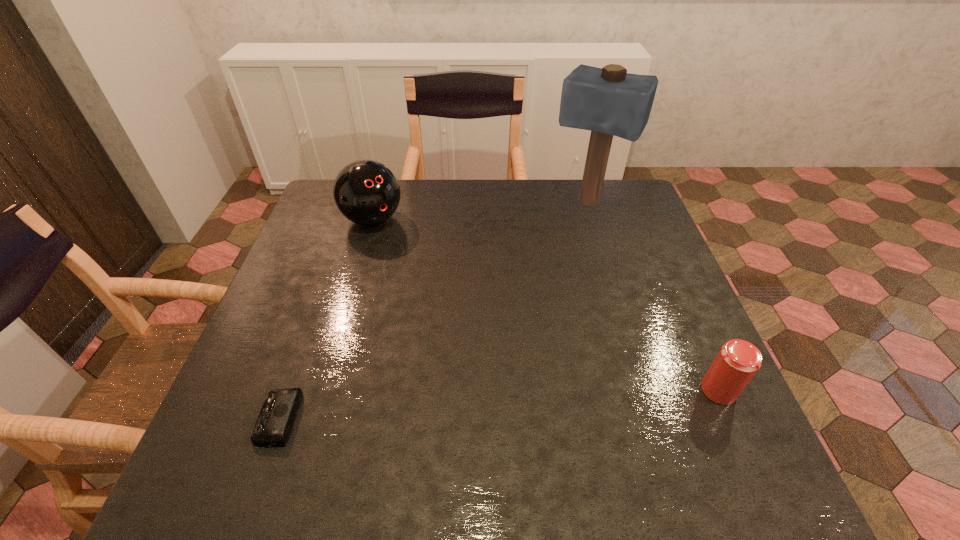
Locate an element on the screen. This screenshot has height=540, width=960. vacant space situated on the striking surface of the tallest object is located at coordinates (558, 246).

At what (x,y) coordinates should I click in order to perform the action: click on vacant area located on the striking surface of the tallest object. Please return your answer as a coordinate pair (x, y). Looking at the image, I should click on tap(537, 282).

This screenshot has height=540, width=960. In order to click on bowling ball located in the far edge section of the desktop in this screenshot , I will do `click(366, 192)`.

Locate an element on the screen. This screenshot has width=960, height=540. mallet that is at the far edge is located at coordinates (608, 101).

I want to click on alarm clock located in the near edge section of the desktop, so click(275, 421).

Identify the location of beer can present at the near edge. (738, 361).

This screenshot has height=540, width=960. I want to click on alarm clock present at the left edge, so click(275, 421).

Find the location of a particular element. This screenshot has height=540, width=960. bowling ball that is at the left edge is located at coordinates (366, 192).

Where is `beer can that is at the right edge`? The image size is (960, 540). beer can that is at the right edge is located at coordinates (738, 361).

I want to click on mallet at the right edge, so [608, 101].